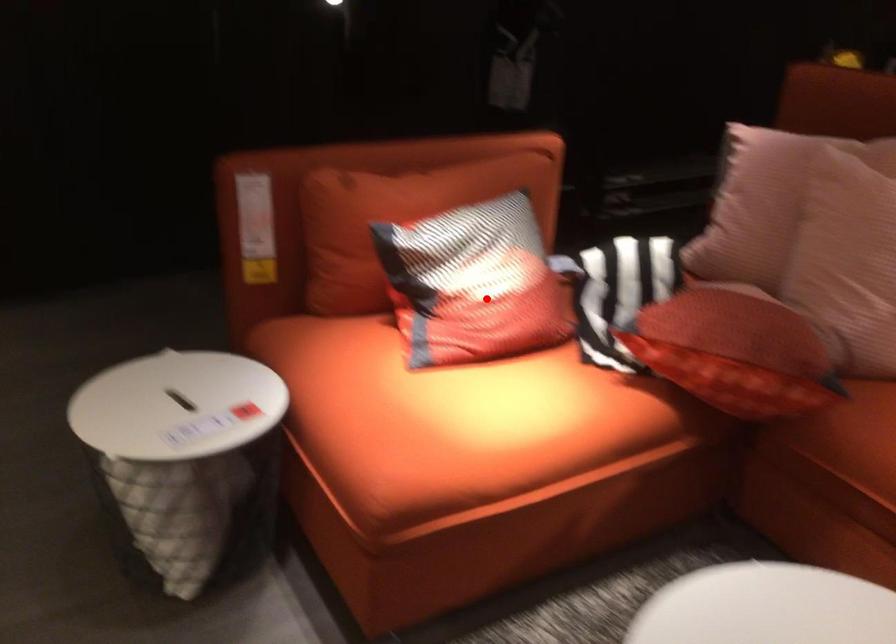
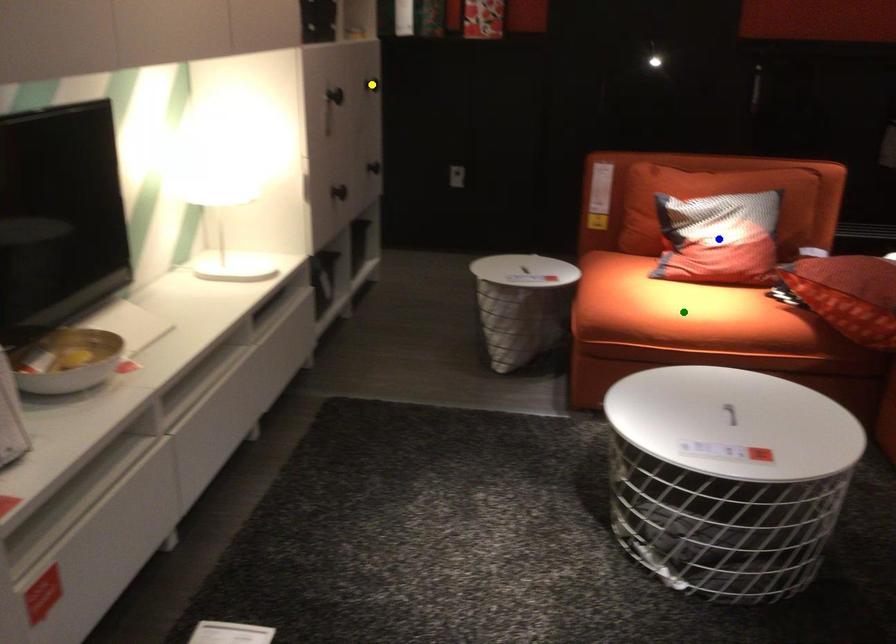
Question: I am providing you with two images of the same scene from different viewpoints. A red point is marked on the first image. You are given multiple points on the second image. In image 2, which mark is for the same physical point as the one in image 1?

Choices:
 (A) yellow point
 (B) green point
 (C) blue point

Answer: (C)